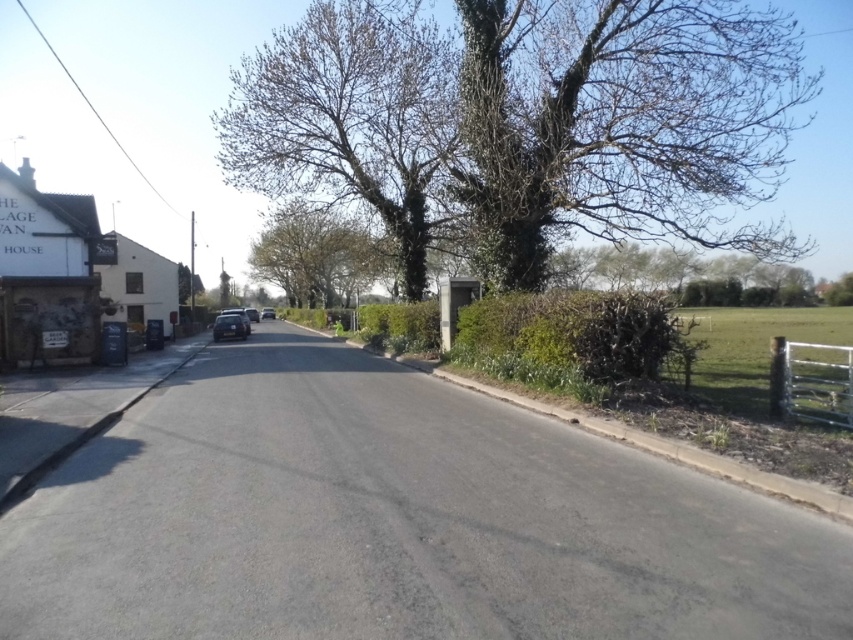
You are a delivery driver who needs to park your shiny silver car at center. The parking spot is right next to the green leafy tree at upper center. Since your car is 2 meters tall, will it fit under the tree without hitting the branches?

The green leafy tree at upper center is taller than the shiny silver car at center, so the car will fit under the tree without hitting the branches.

You are driving a car that requires a minimum of 20 meters clearance to safely make a U turn. You see a green leafy tree at center and a metallic silver car at center in your view. Is there enough space between them to perform the U turn?

The green leafy tree at center is 23.37 meters away from the metallic silver car at center. Since the required clearance is 20 meters, there is sufficient space to safely make the U turn between them.

In the scene shown: You are a pedestrian standing at the edge of the road. You see a green leafy tree at center and a metallic silver car at center. Which object is closer to you?

The green leafy tree at center is positioned over metallic silver car at center, so the tree is closer to you than the car.